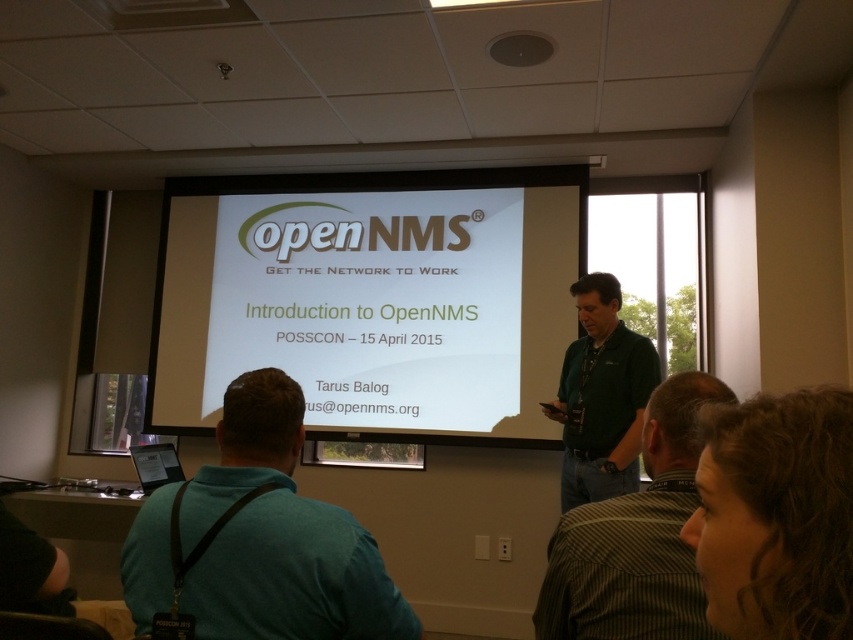
How much distance is there between teal fabric shirt at lower left and green shirt at center?

teal fabric shirt at lower left and green shirt at center are 19.85 inches apart.

Measure the distance from teal fabric shirt at lower left to green shirt at center.

They are 19.85 inches apart.

The height and width of the screenshot is (640, 853). What do you see at coordinates (259, 540) in the screenshot?
I see `teal fabric shirt at lower left` at bounding box center [259, 540].

I want to click on teal fabric shirt at lower left, so click(259, 540).

In the scene shown: Is white glossy projector screen at center below teal fabric shirt at lower left?

Actually, white glossy projector screen at center is above teal fabric shirt at lower left.

Is point (546, 269) positioned after point (195, 564)?

Yes, point (546, 269) is farther from viewer.

The width and height of the screenshot is (853, 640). I want to click on white glossy projector screen at center, so click(370, 298).

Can you confirm if green shirt at center is smaller than green fabric shirt at center?

Indeed, green shirt at center has a smaller size compared to green fabric shirt at center.

Between point (653, 545) and point (575, 452), which one is positioned behind?

Positioned behind is point (575, 452).

Is point (581, 627) less distant than point (585, 300)?

Yes, it is.

Where is `green shirt at center`? The image size is (853, 640). green shirt at center is located at coordinates (636, 538).